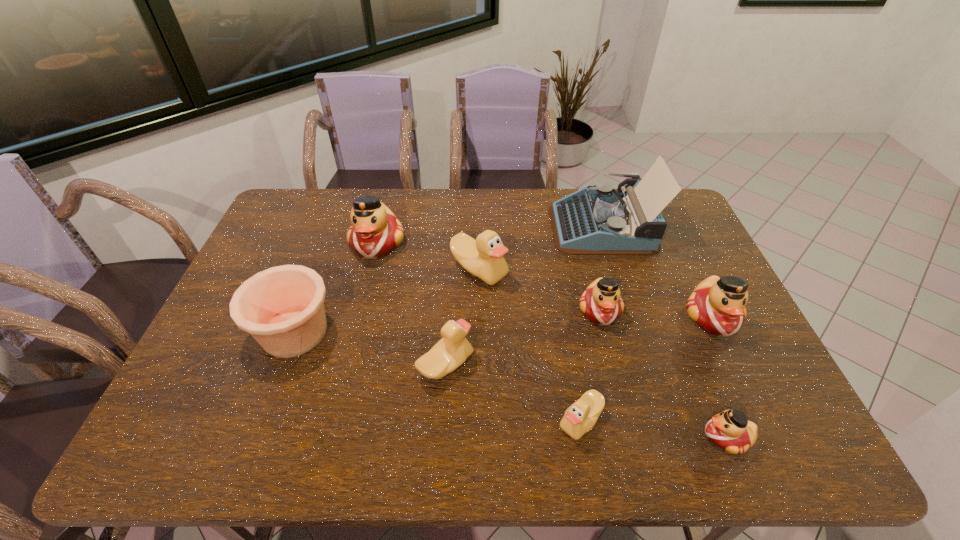
The height and width of the screenshot is (540, 960). In order to click on vacant area situated 0.350m at the beak of the rightmost beige duck in this screenshot , I will do `click(407, 421)`.

The height and width of the screenshot is (540, 960). Identify the location of vacant space situated at the beak of the rightmost beige duck. (527, 421).

You are a GUI agent. You are given a task and a screenshot of the screen. Output one action in this format:
    pyautogui.click(x=<x>, y=<y>)
    Task: Click on the vacant space situated at the beak of the rightmost beige duck
    The image size is (960, 540).
    Given the screenshot: What is the action you would take?
    pyautogui.click(x=471, y=421)

The width and height of the screenshot is (960, 540). What are the coordinates of `vacant area situated on the face of the smallest red duck` in the screenshot? It's located at (539, 437).

I want to click on free spot located on the face of the smallest red duck, so [x=547, y=437].

Find the location of a particular element. This screenshot has width=960, height=540. free point located on the face of the smallest red duck is located at coordinates (x=574, y=437).

I want to click on typewriter present at the far edge, so click(591, 221).

This screenshot has width=960, height=540. In order to click on duck that is at the far edge in this screenshot , I will do `click(375, 231)`.

Identify the location of object positioned at the left edge. (282, 307).

Image resolution: width=960 pixels, height=540 pixels. Identify the location of typewriter that is at the right edge. 591,221.